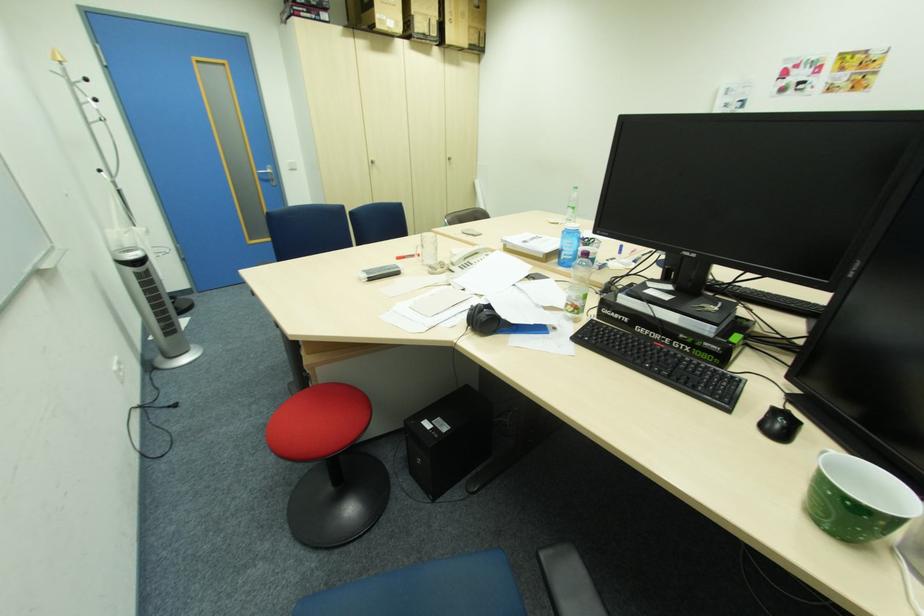
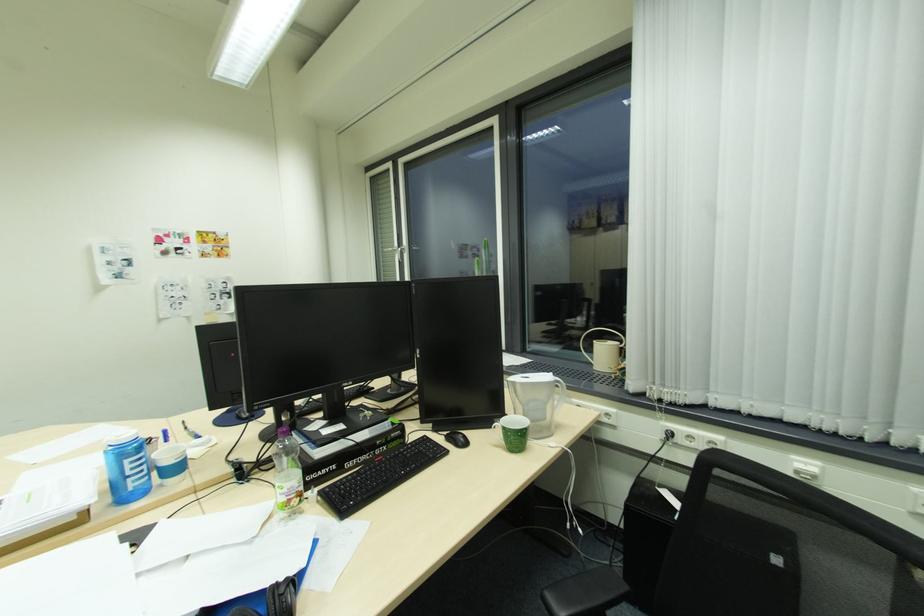
In the second image, find the point that corresponds to point 746,103 in the first image.

(131, 262)